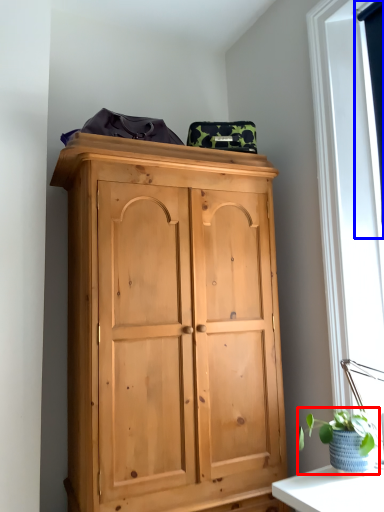
Question: Which object appears closest to the camera in this image, houseplant (highlighted by a red box) or window screen (highlighted by a blue box)?

Choices:
 (A) houseplant
 (B) window screen

Answer: (A)